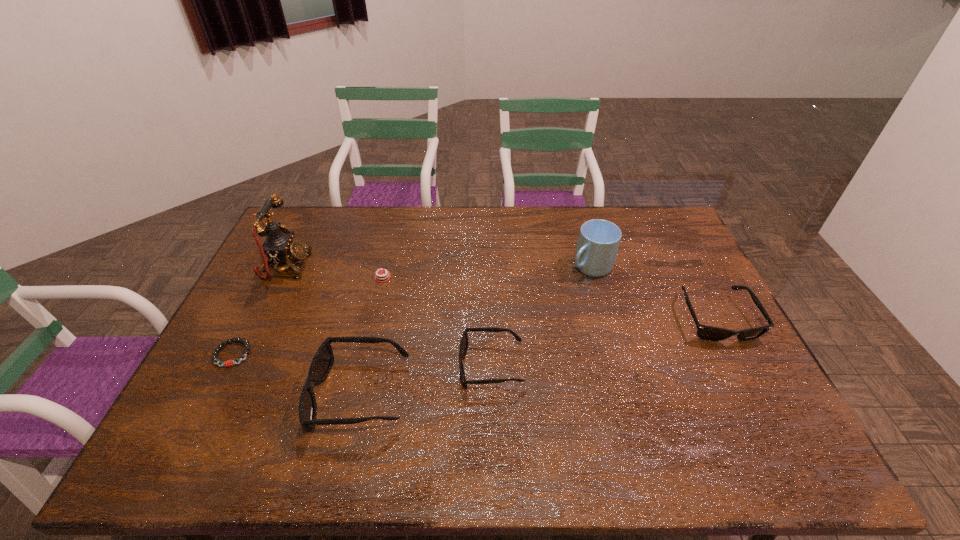
Select which object appears as the third closest to the sixth tallest object. Please provide its 2D coordinates. Your answer should be formatted as a tuple, i.e. [(x, y)], where the tuple contains the x and y coordinates of a point satisfying the conditions above.

[(464, 342)]

You are a GUI agent. You are given a task and a screenshot of the screen. Output one action in this format:
    pyautogui.click(x=<x>, y=<y>)
    Task: Click on the sunglasses that is the second closest to the rightmost sunglasses
    
    Given the screenshot: What is the action you would take?
    click(x=323, y=360)

Choose which sunglasses is the second nearest neighbor to the tallest object. Please provide its 2D coordinates. Your answer should be formatted as a tuple, i.e. [(x, y)], where the tuple contains the x and y coordinates of a point satisfying the conditions above.

[(464, 342)]

Image resolution: width=960 pixels, height=540 pixels. I want to click on free spot that satisfies the following two spatial constraints: 1. on the front-facing side of the fourth shortest object; 2. on the front-facing side of the shortest sunglasses, so click(x=741, y=366).

Identify the location of vacant space that satisfies the following two spatial constraints: 1. on the front of the tallest object, featuring the rotary dial; 2. on the left side of the mug. The image size is (960, 540). tap(285, 267).

Identify the location of free location that satisfies the following two spatial constraints: 1. on the back side of the chocolate cake; 2. on the right side of the second tallest object. The width and height of the screenshot is (960, 540). (385, 267).

At what (x,y) coordinates should I click in order to perform the action: click on free space that satisfies the following two spatial constraints: 1. on the front of the telephone, featuring the rotary dial; 2. on the left side of the second shortest object. Please return your answer as a coordinate pair (x, y). This screenshot has height=540, width=960. Looking at the image, I should click on (279, 277).